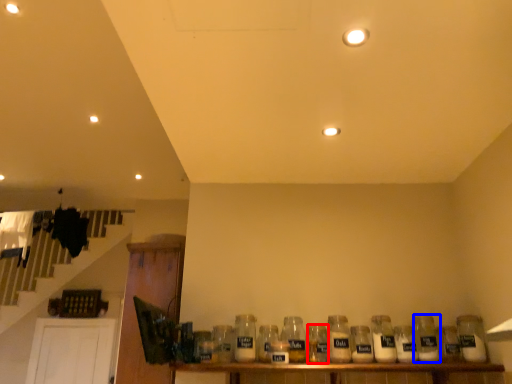
Question: Which object appears farthest to the camera in this image, bottle (highlighted by a red box) or bottle (highlighted by a blue box)?

Choices:
 (A) bottle
 (B) bottle

Answer: (B)